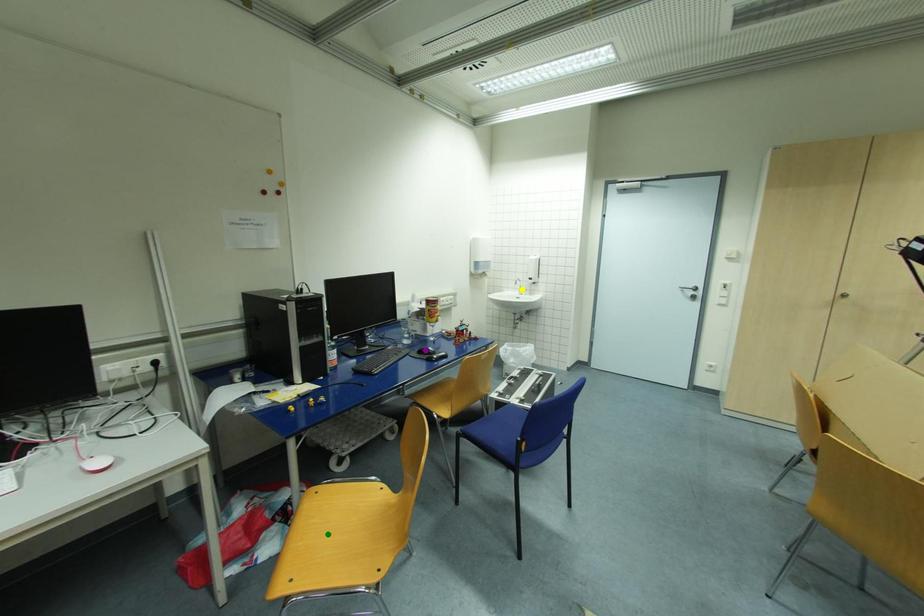
Order these from nearest to farthest:
green point
purple point
yellow point

green point, purple point, yellow point